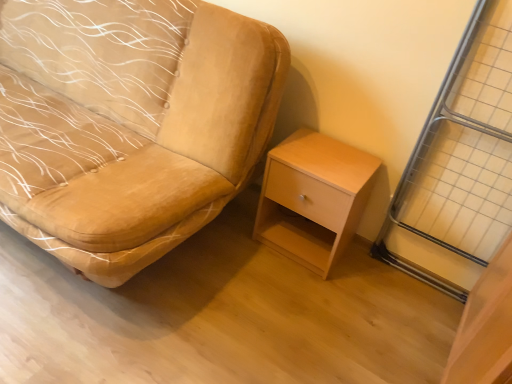
Where is `free space on the front side of light wood/finely finished nightstand at lower right`? This screenshot has height=384, width=512. free space on the front side of light wood/finely finished nightstand at lower right is located at coordinates (297, 298).